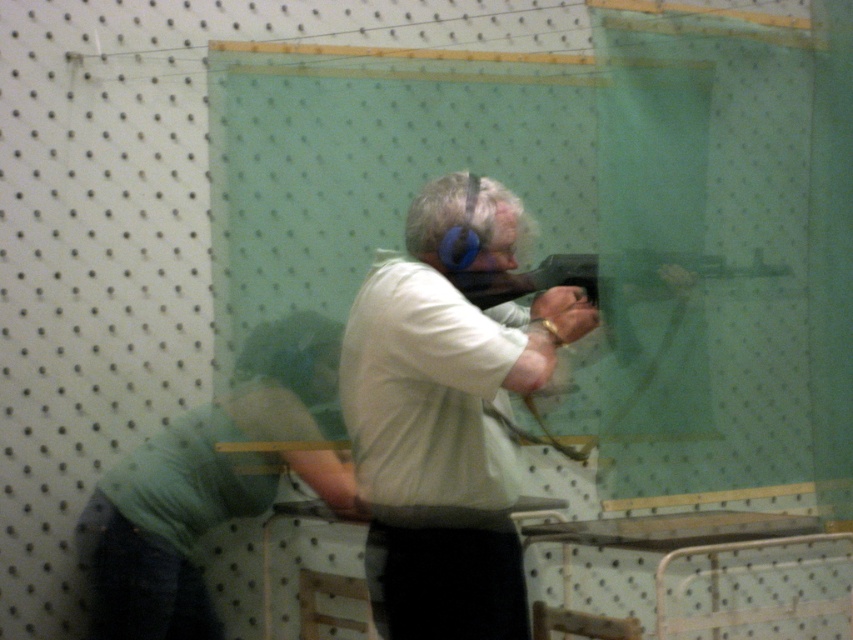
You are a safety inspector checking equipment sizes. The white matte shirt at center must not be larger than the matte black gun at center for safety regulations. Is this setup compliant?

The white matte shirt at center is bigger than the matte black gun at center, so the setup does not comply with safety regulations.

You are a photographer trying to capture a portrait of the person in the white matte shirt at center and the light green shirt at center. Since both shirts are at the same position, which one should you focus on to ensure the subject is in sharp focus?

You should focus on the white matte shirt at center because it is located above the light green shirt at center, making it closer to the camera.